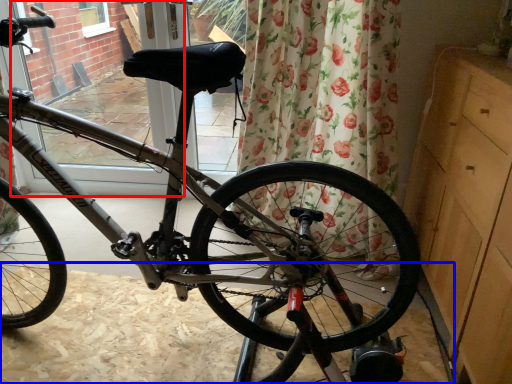
Question: Among these objects, which one is farthest to the camera, screen door (highlighted by a red box) or dirt track (highlighted by a blue box)?

Choices:
 (A) screen door
 (B) dirt track

Answer: (A)